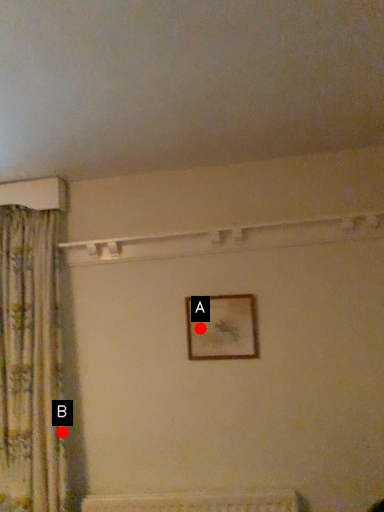
Question: Two points are circled on the image, labeled by A and B beside each circle. Which point is closer to the camera?

Choices:
 (A) A is closer
 (B) B is closer

Answer: (B)